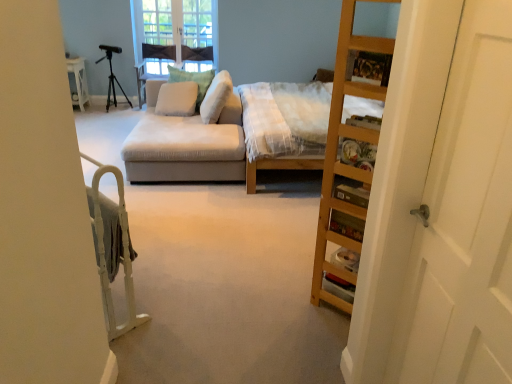
Question: Is white wooden door at right directly adjacent to suede-like beige couch at center?

Choices:
 (A) no
 (B) yes

Answer: (A)

Question: Does white wooden door at right lie in front of suede-like beige couch at center?

Choices:
 (A) yes
 (B) no

Answer: (A)

Question: Is white wooden door at right looking in the opposite direction of suede-like beige couch at center?

Choices:
 (A) no
 (B) yes

Answer: (A)

Question: Considering the relative sizes of white wooden door at right and suede-like beige couch at center in the image provided, is white wooden door at right shorter than suede-like beige couch at center?

Choices:
 (A) no
 (B) yes

Answer: (A)

Question: Does white wooden door at right have a smaller size compared to suede-like beige couch at center?

Choices:
 (A) yes
 (B) no

Answer: (A)

Question: In terms of size, does white fabric pillow at center, placed as the third pillow when sorted from left to right, appear bigger or smaller than green textured pillow at center, which is the second pillow from left to right?

Choices:
 (A) small
 (B) big

Answer: (B)

Question: Considering the positions of white fabric pillow at center, placed as the third pillow when sorted from left to right, and green textured pillow at center, which is the second pillow from left to right, in the image, is white fabric pillow at center, placed as the third pillow when sorted from left to right, taller or shorter than green textured pillow at center, which is the second pillow from left to right,?

Choices:
 (A) tall
 (B) short

Answer: (B)

Question: From a real-world perspective, is white fabric pillow at center, placed as the third pillow when sorted from left to right, above or below green textured pillow at center, which is the second pillow from left to right?

Choices:
 (A) below
 (B) above

Answer: (B)

Question: From the image's perspective, is white fabric pillow at center, which is the 1th pillow in right-to-left order, above or below green textured pillow at center, the second pillow in the right-to-left sequence?

Choices:
 (A) below
 (B) above

Answer: (A)

Question: In the image, is clear glass window at upper center on the left side or the right side of white fabric pillow at center, placed as the third pillow when sorted from left to right?

Choices:
 (A) right
 (B) left

Answer: (B)

Question: In terms of width, does clear glass window at upper center look wider or thinner when compared to white fabric pillow at center, placed as the third pillow when sorted from left to right?

Choices:
 (A) wide
 (B) thin

Answer: (B)

Question: Based on their sizes in the image, would you say clear glass window at upper center is bigger or smaller than white fabric pillow at center, placed as the third pillow when sorted from left to right?

Choices:
 (A) small
 (B) big

Answer: (A)

Question: Is clear glass window at upper center in front of or behind white fabric pillow at center, which is the 1th pillow in right-to-left order, in the image?

Choices:
 (A) front
 (B) behind

Answer: (B)

Question: From a real-world perspective, is beige fabric pillow at center, acting as the first pillow starting from the left, physically located above or below green textured pillow at center, which is the second pillow from left to right?

Choices:
 (A) below
 (B) above

Answer: (A)

Question: Looking at the image, does beige fabric pillow at center, the 3th pillow positioned from the right, seem bigger or smaller compared to green textured pillow at center, which is the second pillow from left to right?

Choices:
 (A) small
 (B) big

Answer: (A)